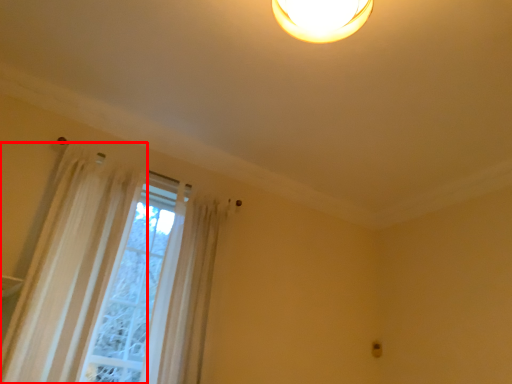
Question: From the image, what is the correct spatial relationship of curtain (annotated by the red box) in relation to shower curtain?

Choices:
 (A) left
 (B) right

Answer: (A)